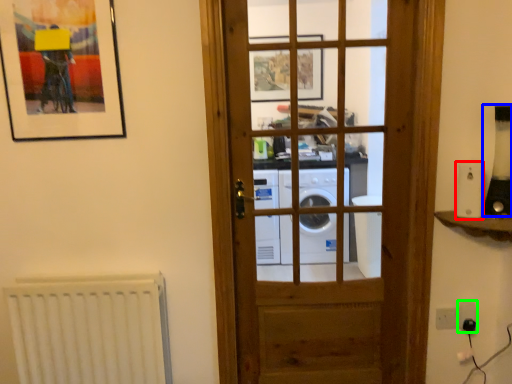
Question: Which object is the farthest from appliance (highlighted by a red box)? Choose among these: appliance (highlighted by a blue box) or electric outlet (highlighted by a green box).

Choices:
 (A) appliance
 (B) electric outlet

Answer: (B)